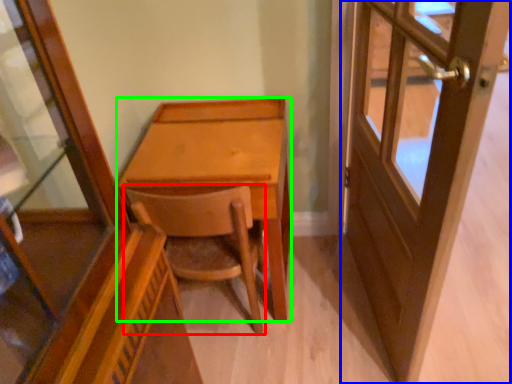
Question: Estimate the real-world distances between objects in this image. Which object is closer to chair (highlighted by a red box), door (highlighted by a blue box) or desk (highlighted by a green box)?

Choices:
 (A) door
 (B) desk

Answer: (B)